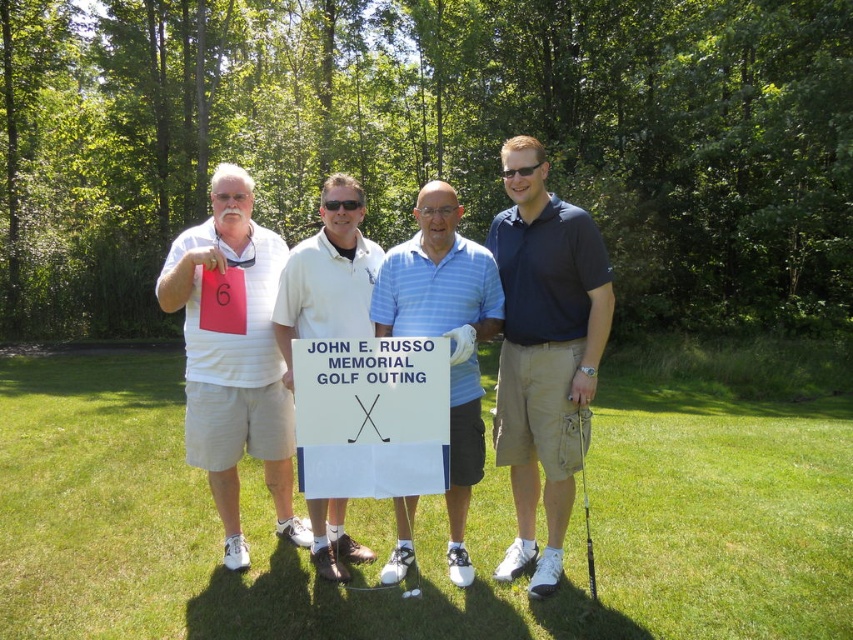
You are a photographer taking a group photo of the two men wearing dark blue polo shirt at center and white cotton polo shirt at center. Which one should you zoom in on more to ensure their shirts are clearly visible in the photo?

The dark blue polo shirt at center is bigger than the white cotton polo shirt at center, so you should zoom in more on the dark blue polo shirt at center to ensure its details are clearly visible.

You are a photographer taking a picture of the green grass at center and the white cotton polo shirt at center. Which object should you focus on first if you want to capture both in focus?

The white cotton polo shirt at center is above the green grass at center, so focusing on the white cotton polo shirt at center first will ensure both are in focus as the grass is behind it.

You are a photographer at the golf outing. You need to capture a photo where the green grass at center is visible above the white matte shorts at left. Is this possible?

The green grass at center is not as tall as white matte shorts at left, so it cannot be seen above the white matte shorts at left in the photo.